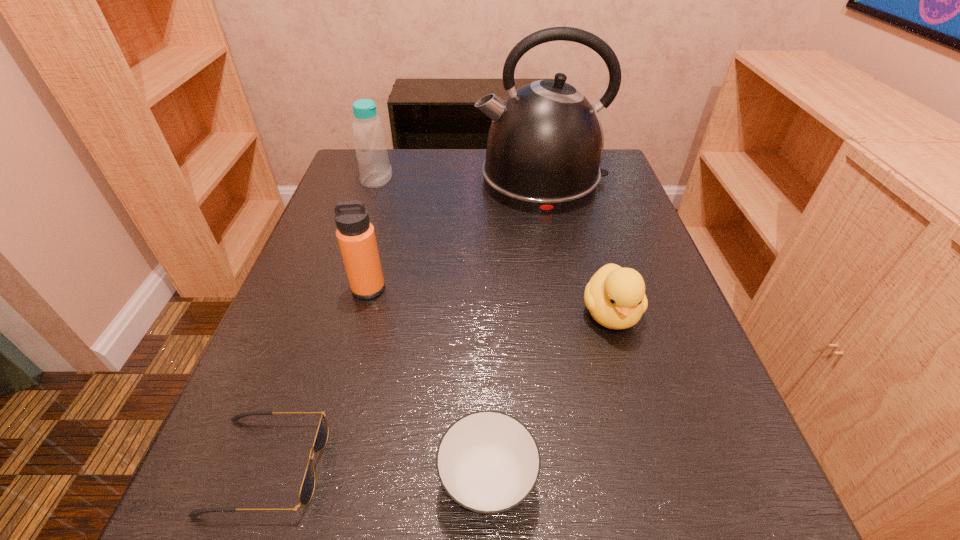
This screenshot has height=540, width=960. I want to click on vacant region at the far right corner of the desktop, so [x=606, y=183].

At what (x,y) coordinates should I click in order to perform the action: click on free region at the near right corner. Please return your answer as a coordinate pair (x, y). This screenshot has height=540, width=960. Looking at the image, I should click on (699, 496).

Identify the location of free area in between the bottle and the duck. [493, 247].

You are a GUI agent. You are given a task and a screenshot of the screen. Output one action in this format:
    pyautogui.click(x=<x>, y=<y>)
    Task: Click on the free space between the thermos bottle and the soup bowl
    
    Given the screenshot: What is the action you would take?
    pyautogui.click(x=428, y=385)

You are a GUI agent. You are given a task and a screenshot of the screen. Output one action in this format:
    pyautogui.click(x=<x>, y=<y>)
    Task: Click on the free space between the soup bowl and the third shortest object
    Image resolution: width=960 pixels, height=540 pixels.
    Given the screenshot: What is the action you would take?
    pyautogui.click(x=549, y=397)

Identify the location of empty space that is in between the thermos bottle and the sunglasses. The width and height of the screenshot is (960, 540). (318, 377).

At what (x,y) coordinates should I click in order to perform the action: click on free space between the bottle and the kettle. Please return your answer as a coordinate pair (x, y). This screenshot has height=540, width=960. Looking at the image, I should click on (459, 180).

Image resolution: width=960 pixels, height=540 pixels. I want to click on free spot between the shortest object and the bottle, so click(x=322, y=322).

Locate an element on the screen. This screenshot has height=540, width=960. free space between the tallest object and the thermos bottle is located at coordinates 455,234.

Identify the location of empty location between the tallest object and the soup bowl. This screenshot has width=960, height=540. (515, 331).